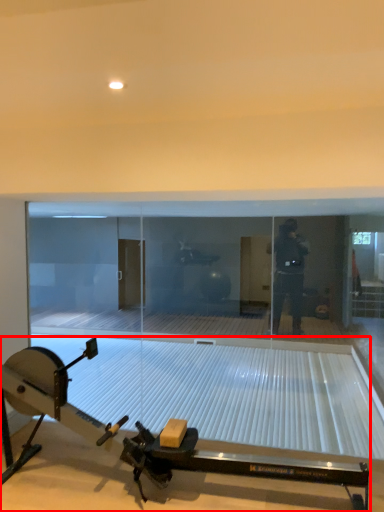
Question: In this image, where is sport equipment (annotated by the red box) located relative to glass door?

Choices:
 (A) right
 (B) left

Answer: (B)